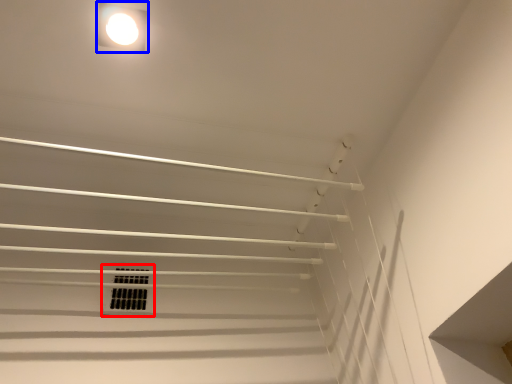
Question: Which object appears closest to the camera in this image, window (highlighted by a red box) or lamp (highlighted by a blue box)?

Choices:
 (A) window
 (B) lamp

Answer: (B)